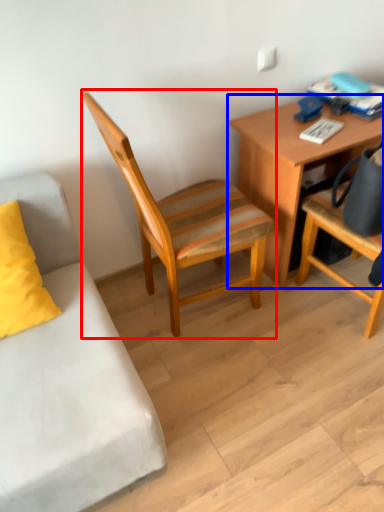
Question: Among these objects, which one is farthest to the camera, chair (highlighted by a red box) or desk (highlighted by a blue box)?

Choices:
 (A) chair
 (B) desk

Answer: (B)